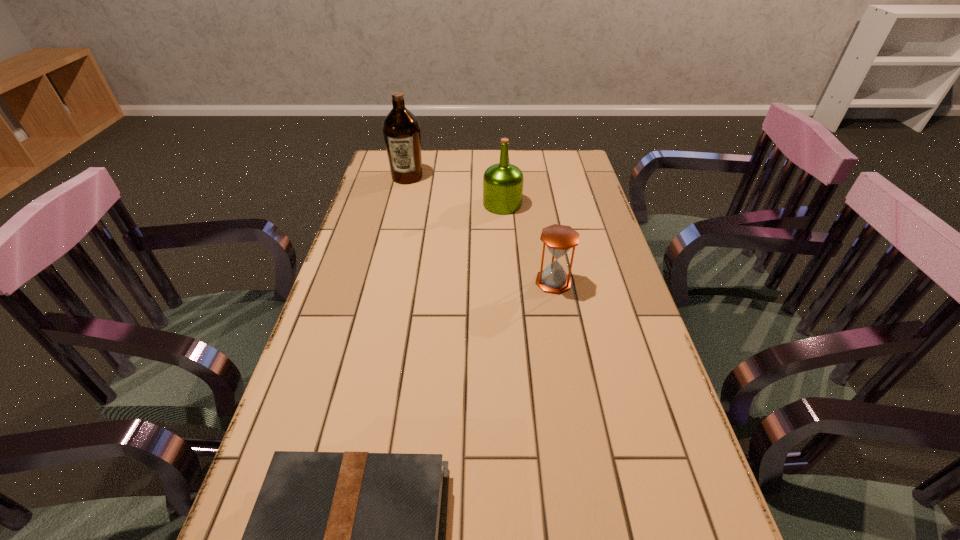
I want to click on the tallest object, so click(x=401, y=129).

Find the location of a particular element. The width and height of the screenshot is (960, 540). the taller olive oil is located at coordinates (401, 129).

Locate an element on the screen. the third nearest object is located at coordinates (503, 182).

This screenshot has height=540, width=960. Identify the location of the nearer olive oil. (503, 182).

Where is `the rightmost object`? the rightmost object is located at coordinates (559, 239).

Locate an element on the screen. The width and height of the screenshot is (960, 540). the second nearest object is located at coordinates (559, 239).

Where is `free space located 0.090m on the label of the farther olive oil`? The width and height of the screenshot is (960, 540). free space located 0.090m on the label of the farther olive oil is located at coordinates [401, 199].

Image resolution: width=960 pixels, height=540 pixels. I want to click on vacant region located 0.100m on the left of the third shortest object, so click(x=453, y=204).

In order to click on free spot located on the left of the rightmost object in this screenshot , I will do `click(509, 282)`.

Identify the location of object at the far edge. (401, 129).